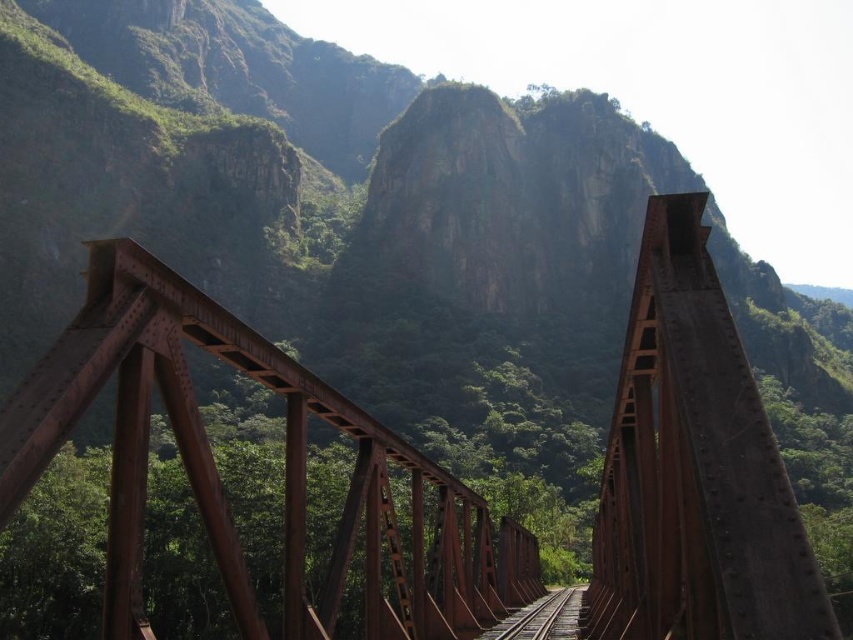
Question: Which point is farther from the camera taking this photo?

Choices:
 (A) (381, 513)
 (B) (495, 636)

Answer: (B)

Question: Is rusty metal train bridge at center to the left of rusty metal train track at center from the viewer's perspective?

Choices:
 (A) yes
 (B) no

Answer: (A)

Question: Does rusty metal train bridge at center lie in front of rusty metal train track at center?

Choices:
 (A) no
 (B) yes

Answer: (B)

Question: Which of the following is the farthest from the observer?

Choices:
 (A) rusty metal train track at center
 (B) rusty metal train bridge at center

Answer: (A)

Question: Does rusty metal train bridge at center appear under rusty metal train track at center?

Choices:
 (A) yes
 (B) no

Answer: (B)